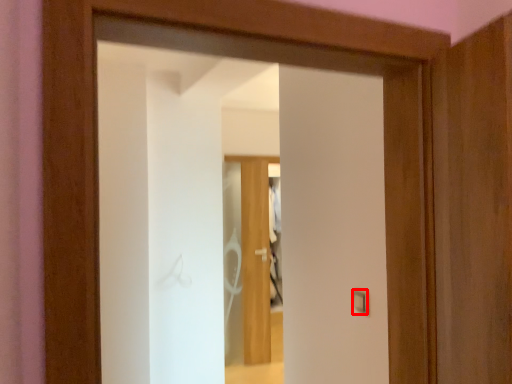
Question: From the image's perspective, where is light switch (annotated by the red box) located in relation to door in the image?

Choices:
 (A) below
 (B) above

Answer: (A)